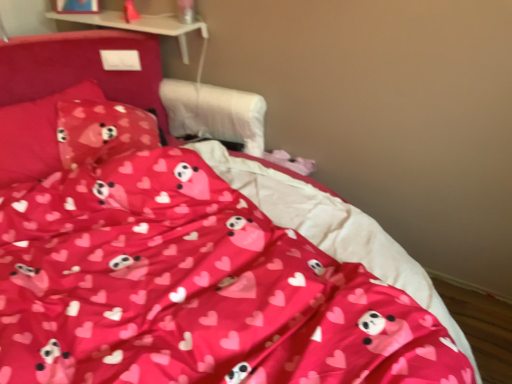
Question: From their relative heights in the image, would you say matte pink fabric pillow at upper left, which is the first pillow from right to left, is taller or shorter than pink fabric pillow at upper left, which is the second pillow in right-to-left order?

Choices:
 (A) tall
 (B) short

Answer: (B)

Question: From the image's perspective, is matte pink fabric pillow at upper left, which is the first pillow from right to left, positioned above or below pink fabric pillow at upper left, which is the second pillow in right-to-left order?

Choices:
 (A) above
 (B) below

Answer: (B)

Question: Visually, is matte pink fabric pillow at upper left, which is the first pillow from right to left, positioned to the left or to the right of pink fabric pillow at upper left, which is the second pillow in right-to-left order?

Choices:
 (A) left
 (B) right

Answer: (B)

Question: Considering the relative positions of pink fabric pillow at upper left, which appears as the first pillow when viewed from the left, and matte pink fabric pillow at upper left, which is the first pillow from right to left, in the image provided, is pink fabric pillow at upper left, which appears as the first pillow when viewed from the left, to the left or to the right of matte pink fabric pillow at upper left, which is the first pillow from right to left,?

Choices:
 (A) left
 (B) right

Answer: (A)

Question: In terms of height, does pink fabric pillow at upper left, which is the second pillow in right-to-left order, look taller or shorter compared to matte pink fabric pillow at upper left, marked as the second pillow in a left-to-right arrangement?

Choices:
 (A) short
 (B) tall

Answer: (B)

Question: Looking at the image, does pink fabric pillow at upper left, which appears as the first pillow when viewed from the left, seem bigger or smaller compared to matte pink fabric pillow at upper left, marked as the second pillow in a left-to-right arrangement?

Choices:
 (A) small
 (B) big

Answer: (B)

Question: In the image, is pink fabric pillow at upper left, which appears as the first pillow when viewed from the left, positioned in front of or behind matte pink fabric pillow at upper left, marked as the second pillow in a left-to-right arrangement?

Choices:
 (A) front
 (B) behind

Answer: (A)